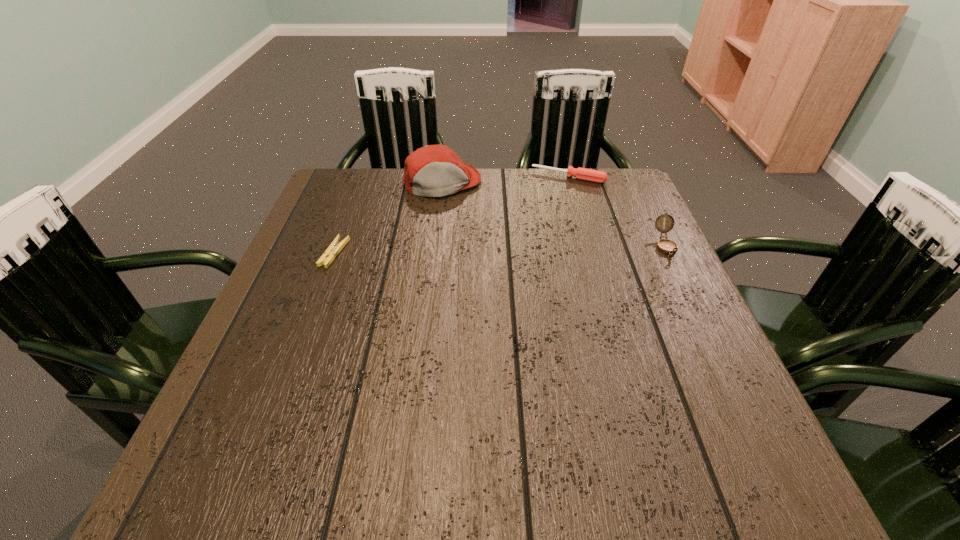
Identify the location of free space located 0.150m on the front-facing side of the cap. The width and height of the screenshot is (960, 540). (466, 231).

Where is `free space located on the front-facing side of the cap`? This screenshot has width=960, height=540. free space located on the front-facing side of the cap is located at coordinates (475, 253).

The image size is (960, 540). What are the coordinates of `vacant space located 0.170m on the front-facing side of the cap` in the screenshot? It's located at (468, 236).

Image resolution: width=960 pixels, height=540 pixels. I want to click on vacant region located 0.100m at the blade of the third tallest object, so click(x=550, y=202).

Where is `vacant region located 0.140m at the blade of the third tallest object`? The width and height of the screenshot is (960, 540). vacant region located 0.140m at the blade of the third tallest object is located at coordinates (546, 210).

The height and width of the screenshot is (540, 960). What are the coordinates of `vacant space located 0.090m at the blade of the third tallest object` in the screenshot? It's located at (551, 200).

This screenshot has width=960, height=540. Find the location of `cap that is at the far edge`. cap that is at the far edge is located at coordinates (434, 170).

Find the location of a particular element. screwdriver located in the far edge section of the desktop is located at coordinates (585, 174).

The height and width of the screenshot is (540, 960). Identify the location of object that is at the left edge. (333, 250).

This screenshot has width=960, height=540. I want to click on compass at the right edge, so click(668, 247).